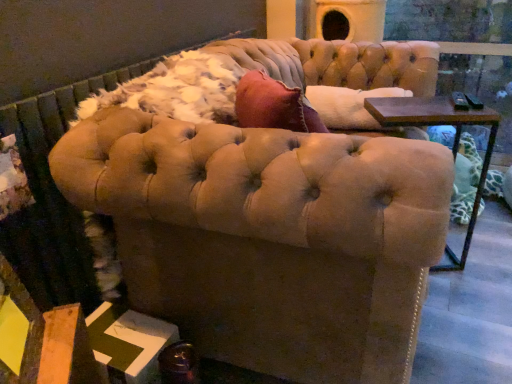
In order to face suede beige chair at center, should I rotate leftwards or rightwards?

It's best to rotate right around 6.949 degrees.

This screenshot has width=512, height=384. Find the location of `suede beige chair at center`. suede beige chair at center is located at coordinates (269, 237).

The height and width of the screenshot is (384, 512). Describe the element at coordinates (269, 237) in the screenshot. I see `suede beige chair at center` at that location.

What do you see at coordinates (449, 20) in the screenshot?
I see `transparent glass door at upper right` at bounding box center [449, 20].

Image resolution: width=512 pixels, height=384 pixels. I want to click on transparent glass door at upper right, so click(x=449, y=20).

At what (x,y) coordinates should I click in order to perform the action: click on suede beige chair at center. Please return your answer as a coordinate pair (x, y). Looking at the image, I should click on (269, 237).

Between transparent glass door at upper right and suede beige chair at center, which one appears on the left side from the viewer's perspective?

From the viewer's perspective, suede beige chair at center appears more on the left side.

Is transparent glass door at upper right in front of or behind suede beige chair at center in the image?

transparent glass door at upper right is behind suede beige chair at center.

Does point (460, 26) lie in front of point (407, 237)?

No, it is behind (407, 237).

From the image's perspective, does transparent glass door at upper right appear lower than suede beige chair at center?

No, from the image's perspective, transparent glass door at upper right is not beneath suede beige chair at center.

From a real-world perspective, is transparent glass door at upper right located beneath suede beige chair at center?

Incorrect, from a real-world perspective, transparent glass door at upper right is higher than suede beige chair at center.

Can you confirm if transparent glass door at upper right is thinner than suede beige chair at center?

Indeed, transparent glass door at upper right has a lesser width compared to suede beige chair at center.

Does transparent glass door at upper right have a lesser height compared to suede beige chair at center?

In fact, transparent glass door at upper right may be taller than suede beige chair at center.

Considering the sizes of transparent glass door at upper right and suede beige chair at center in the image, is transparent glass door at upper right bigger or smaller than suede beige chair at center?

In the image, transparent glass door at upper right appears to be smaller than suede beige chair at center.

Is transparent glass door at upper right inside the boundaries of suede beige chair at center, or outside?

transparent glass door at upper right is not inside suede beige chair at center, it's outside.

Is transparent glass door at upper right placed right next to suede beige chair at center?

transparent glass door at upper right and suede beige chair at center are clearly separated.

Is transparent glass door at upper right positioned with its back to suede beige chair at center?

No, suede beige chair at center is not at the back of transparent glass door at upper right.

Based on the photo, what's the angular difference between transparent glass door at upper right and suede beige chair at center's facing directions?

The facing directions of transparent glass door at upper right and suede beige chair at center are 95.3 degrees apart.

In order to click on glass door above the suede beige chair at center (from a real-world perspective) in this screenshot , I will do `click(449, 20)`.

Does suede beige chair at center appear on the left side of transparent glass door at upper right?

Yes.

Relative to transparent glass door at upper right, is suede beige chair at center in front or behind?

In the image, suede beige chair at center appears in front of transparent glass door at upper right.

Which is farther, (268, 149) or (505, 7)?

Positioned behind is point (505, 7).

Consider the image. From the image's perspective, who appears lower, suede beige chair at center or transparent glass door at upper right?

suede beige chair at center appears lower in the image.

In the scene shown: From a real-world perspective, which object rests below the other?

From a 3D spatial view, suede beige chair at center is below.

Is suede beige chair at center wider or thinner than transparent glass door at upper right?

In the image, suede beige chair at center appears to be wider than transparent glass door at upper right.

Considering the sizes of suede beige chair at center and transparent glass door at upper right in the image, is suede beige chair at center taller or shorter than transparent glass door at upper right?

Clearly, suede beige chair at center is shorter compared to transparent glass door at upper right.

Can you confirm if suede beige chair at center is bigger than transparent glass door at upper right?

Correct, suede beige chair at center is larger in size than transparent glass door at upper right.

Does suede beige chair at center contain transparent glass door at upper right?

No, transparent glass door at upper right is located outside of suede beige chair at center.

Are suede beige chair at center and transparent glass door at upper right making contact?

suede beige chair at center and transparent glass door at upper right are clearly separated.

Is transparent glass door at upper right at the back of suede beige chair at center?

No.

Can you tell me how much suede beige chair at center and transparent glass door at upper right differ in facing direction?

There is a 95.3-degree angle between the facing directions of suede beige chair at center and transparent glass door at upper right.

What are the coordinates of `glass door on the right of suede beige chair at center` in the screenshot? It's located at (449, 20).

Locate an element on the screen. The width and height of the screenshot is (512, 384). glass door located above the suede beige chair at center (from a real-world perspective) is located at coordinates (449, 20).

Find the location of `chair that appears below the transparent glass door at upper right (from a real-world perspective)`. chair that appears below the transparent glass door at upper right (from a real-world perspective) is located at coordinates (269, 237).